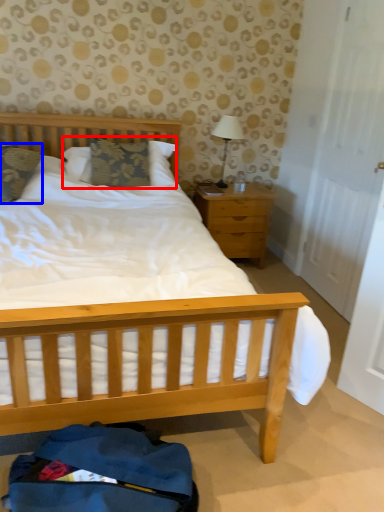
Question: Which object appears closest to the camera in this image, pillow (highlighted by a red box) or pillow (highlighted by a blue box)?

Choices:
 (A) pillow
 (B) pillow

Answer: (B)